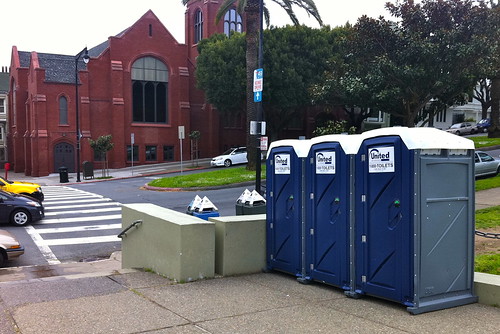
You are a GUI agent. You are given a task and a screenshot of the screen. Output one action in this format:
    pyautogui.click(x=<x>, y=<y>)
    Task: Click on the windows
    
    Given the screenshot: What is the action you would take?
    pyautogui.click(x=140, y=112), pyautogui.click(x=149, y=107), pyautogui.click(x=162, y=103), pyautogui.click(x=165, y=149), pyautogui.click(x=147, y=153), pyautogui.click(x=132, y=157), pyautogui.click(x=238, y=21), pyautogui.click(x=197, y=37), pyautogui.click(x=62, y=105)